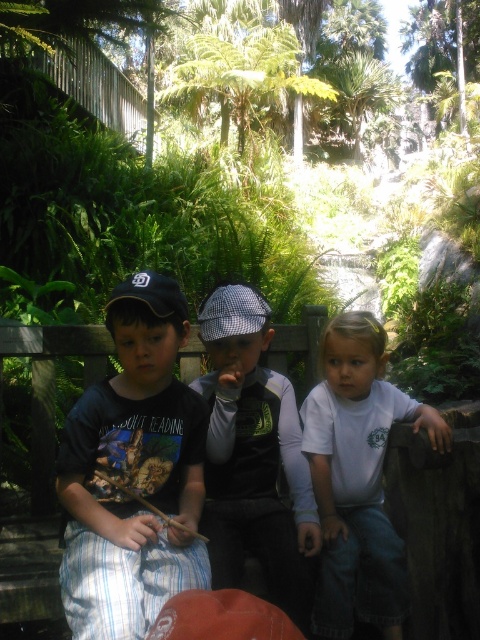
Is point (93, 458) more distant than point (195, 618)?

Yes, point (93, 458) is behind point (195, 618).

Does point (109, 577) come closer to viewer compared to point (226, 609)?

No, (109, 577) is behind (226, 609).

This screenshot has height=640, width=480. Describe the element at coordinates (132, 472) in the screenshot. I see `dark blue cotton shirt at left` at that location.

I want to click on dark blue cotton shirt at left, so click(132, 472).

Can you confirm if white cotton shirt at center is wider than orange fabric baseball hat at lower center?

Yes.

Measure the distance from white cotton shirt at center to orange fabric baseball hat at lower center.

white cotton shirt at center is 32.29 inches from orange fabric baseball hat at lower center.

Where is `white cotton shirt at center`? This screenshot has height=640, width=480. white cotton shirt at center is located at coordinates 358,477.

Between dark blue cotton shirt at left and checkered fabric cap at center, which one appears on the left side from the viewer's perspective?

Positioned to the left is dark blue cotton shirt at left.

Is dark blue cotton shirt at left further to the viewer compared to checkered fabric cap at center?

No.

The height and width of the screenshot is (640, 480). Identify the location of dark blue cotton shirt at left. (132, 472).

Identify the location of dark blue cotton shirt at left. Image resolution: width=480 pixels, height=640 pixels. (132, 472).